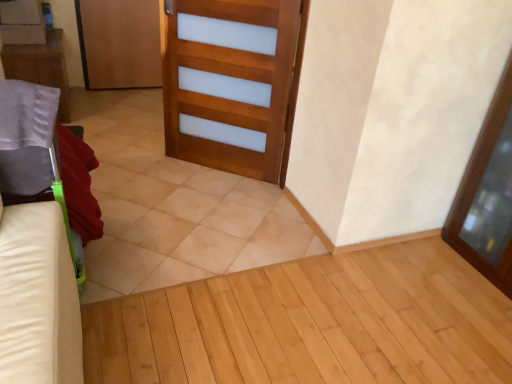
Question: In terms of width, does wooden door at center, the second door when ordered from left to right, look wider or thinner when compared to transparent glass screen door at right?

Choices:
 (A) thin
 (B) wide

Answer: (A)

Question: From a real-world perspective, is wooden door at center, the second door when ordered from left to right, physically located above or below transparent glass screen door at right?

Choices:
 (A) above
 (B) below

Answer: (B)

Question: Estimate the real-world distances between objects in this image. Which object is closer to the beige tile at center?

Choices:
 (A) matte gray pillow at left
 (B) transparent glass screen door at right
 (C) wooden door at center, the 2th door positioned from the back
 (D) wooden door at upper left, which ranks as the 2th door in bottom-to-top order

Answer: (C)

Question: Which of these objects is positioned closest to the wooden door at center, acting as the first door starting from the right?

Choices:
 (A) transparent glass screen door at right
 (B) wooden door at upper left, which is counted as the 1th door, starting from the top
 (C) beige tile at center
 (D) matte gray pillow at left

Answer: (C)